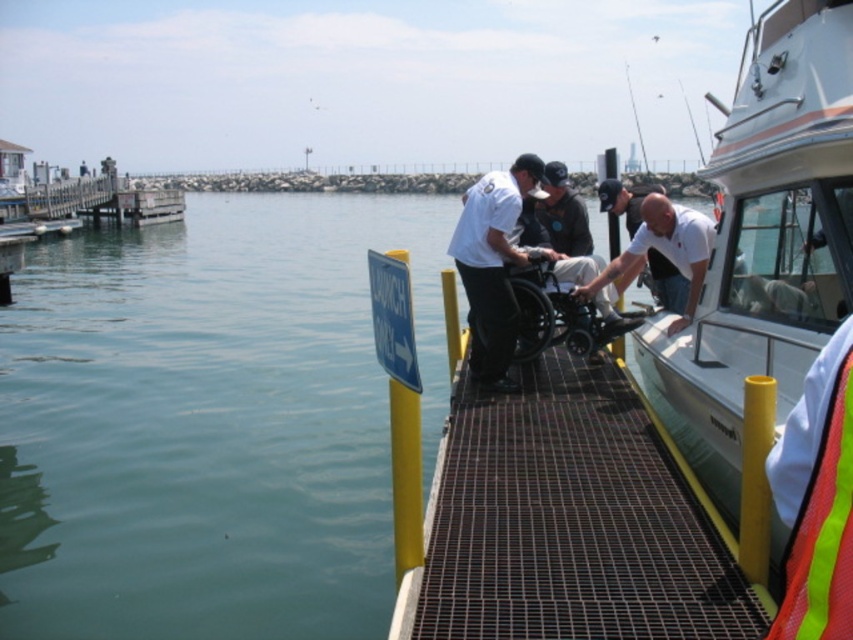
You are a visitor at the marina and want to locate the green water at lower left and the reflective orange life jacket at lower right. Based on the scene description, which object is situated to the left of the other?

The green water at lower left is positioned on the left side of reflective orange life jacket at lower right.

You are a safety inspector checking the marina. You notice the metallic gray dock at center and the reflective orange life jacket at lower right. According to safety regulations, the dock must be wider than the life jacket. Is this requirement met?

The metallic gray dock at center might be wider than reflective orange life jacket at lower right, so it is possible that the requirement is met, but further measurement is needed to confirm.

You are a visitor at the marina and need to board the white glossy boat at right. The metallic gray dock at center is your current location. Which direction should you move to reach the boat?

You should move towards the right from the metallic gray dock at center to reach the white glossy boat at right since the boat is positioned to the right of the dock.